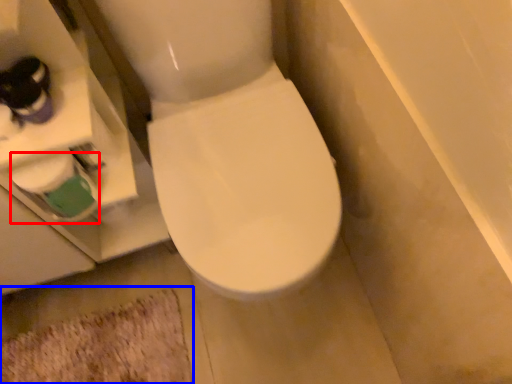
Question: Among these objects, which one is farthest to the camera, toilet paper (highlighted by a red box) or bath mat (highlighted by a blue box)?

Choices:
 (A) toilet paper
 (B) bath mat

Answer: (B)